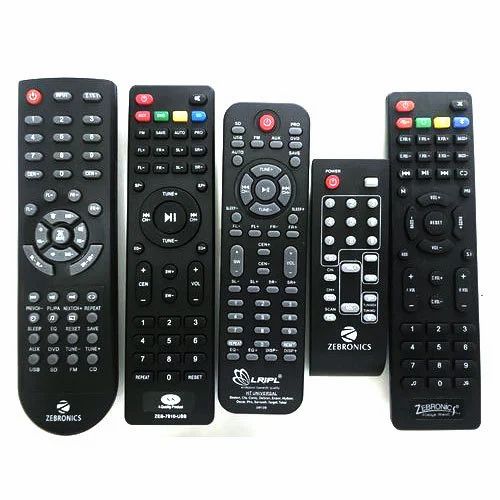
This screenshot has height=500, width=500. I want to click on remotes, so click(83, 289), click(167, 265), click(257, 264), click(368, 273), click(440, 280).